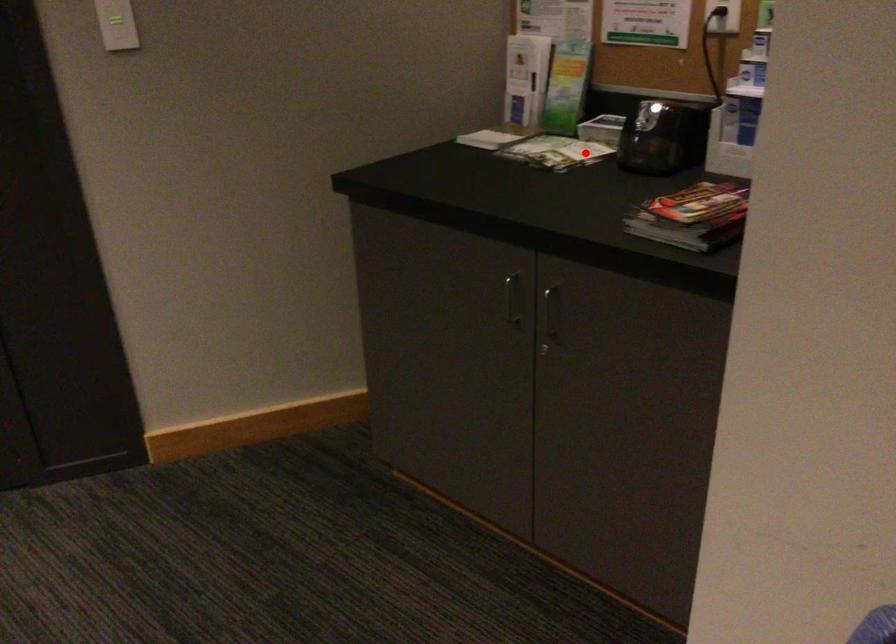
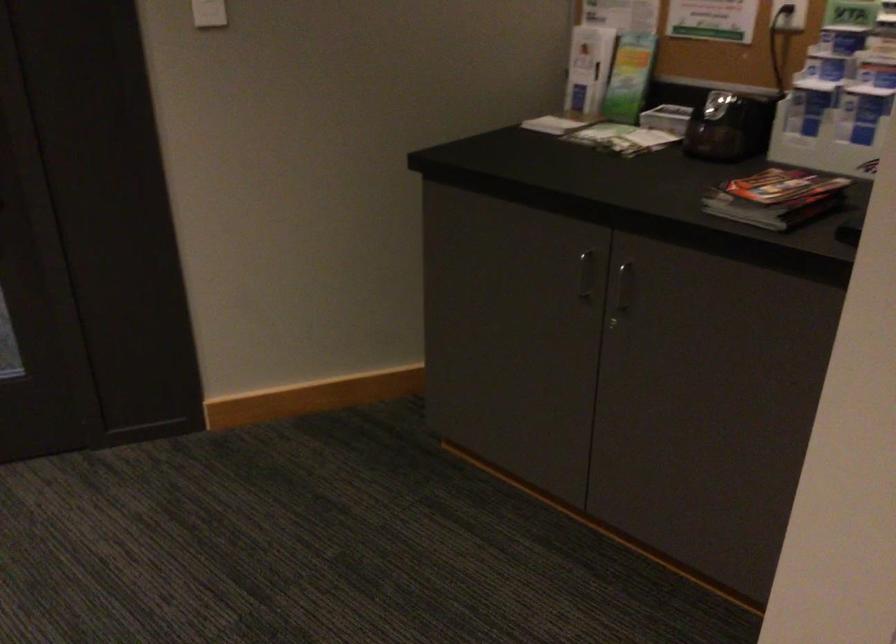
Locate, in the second image, the point that corresponds to the highlighted location in the first image.

(647, 140)